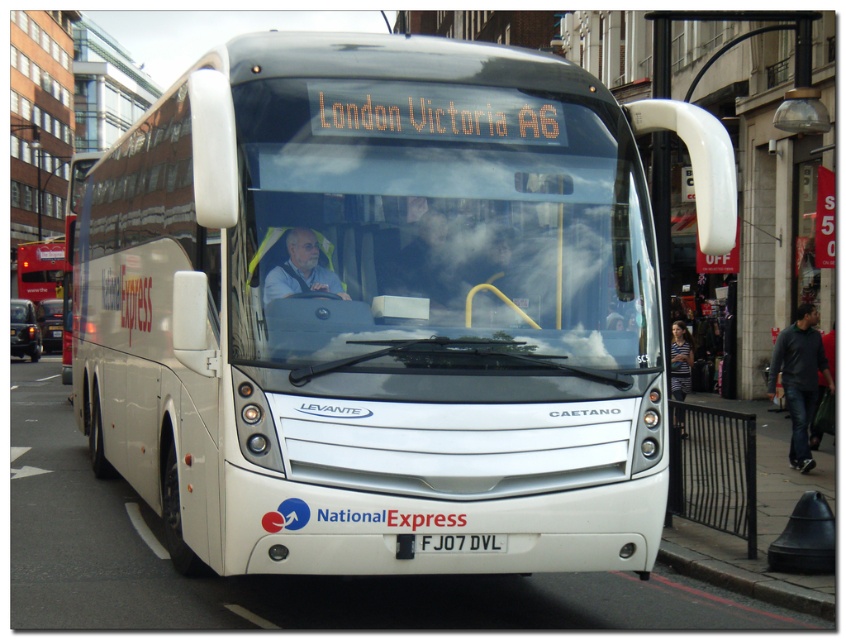
You are a city planner analyzing traffic flow and need to determine if the white matte bus at center and the matte white bus at left can park side by side in a parking space that is 12 meters long. Based on their lengths, will they fit?

The white matte bus at center is shorter than the matte white bus at left. However, without knowing their exact lengths, it is impossible to determine if their combined length exceeds 12 meters. Additional information about each bus length is required to answer this question accurately.

From the picture: You are a delivery person trying to load a package onto the roof of the white matte bus at center. The package is 1.2 meters tall. Considering the transparent glass windshield at center, can you safely place the package without it hitting the windshield?

The white matte bus at center has a lesser height compared to the transparent glass windshield at center, meaning the windshield is taller. Since the windshield is taller than the bus itself, placing the package on the roof might not be feasible as the windshield could obstruct or hit the package during transportation. It is safer to avoid placing the package on the roof to prevent damage.

You are standing at the point labeled point (x=31, y=292) and want to walk to the point labeled point (x=484, y=541). Given the bus is parked on the street, which direction should you move relative to the bus to reach your destination?

Since point (x=31, y=292) is behind point (x=484, y=541), you should move forward towards the front of the bus to reach your destination.